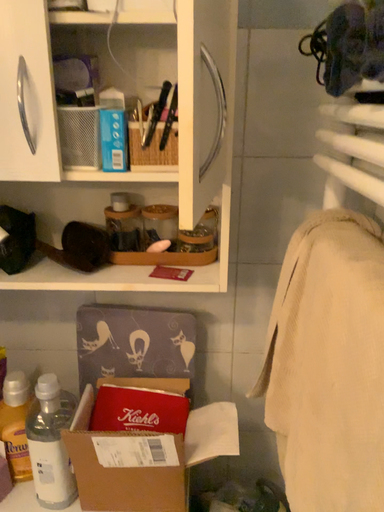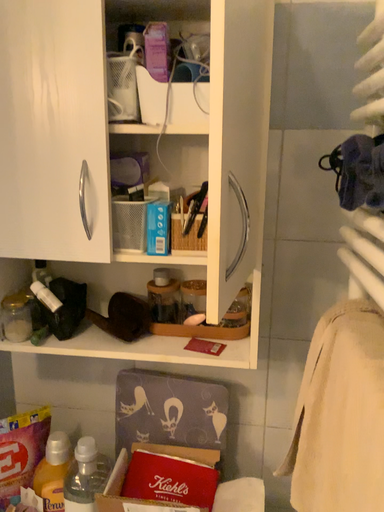
Question: How did the camera likely rotate when shooting the video?

Choices:
 (A) rotated upward
 (B) rotated downward

Answer: (A)